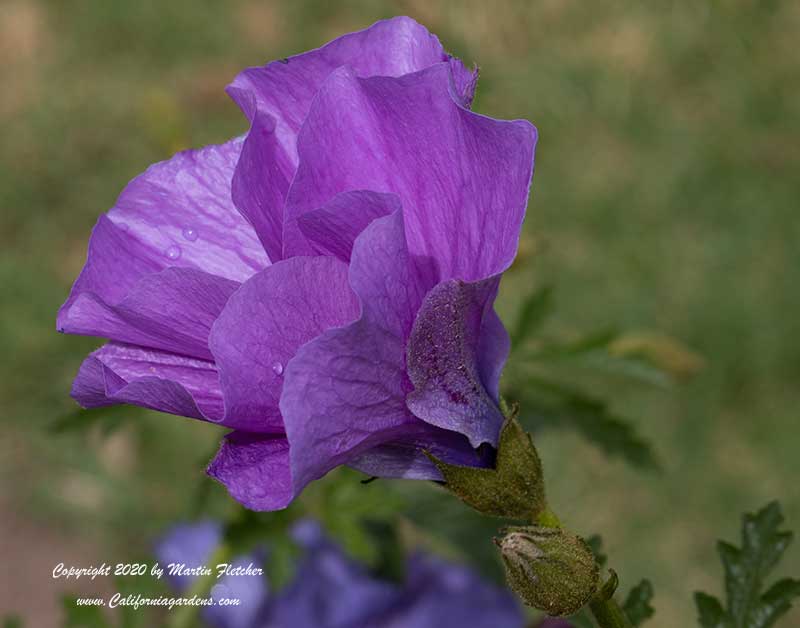
Find the location of `another flower in the background`. another flower in the background is located at coordinates (366, 590).